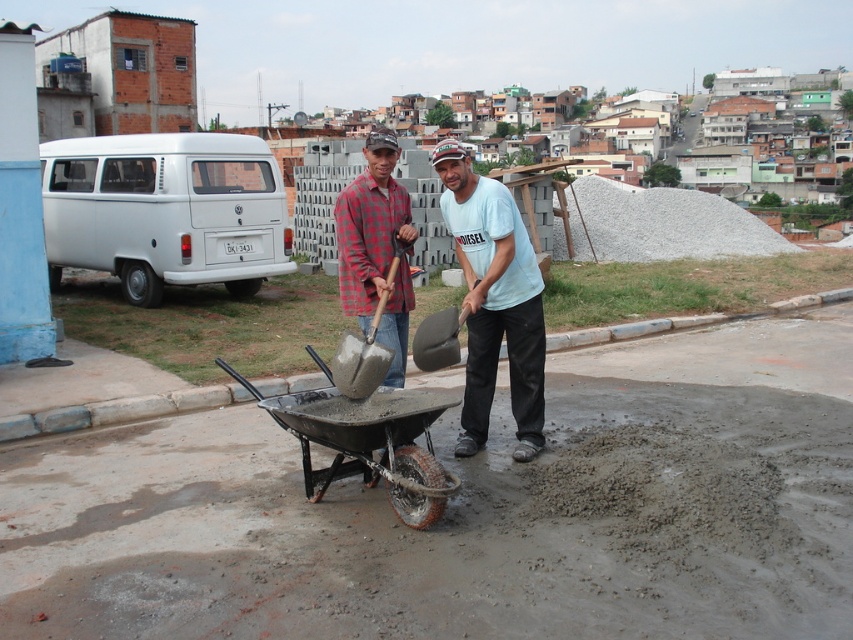
Who is higher up, metallic gray wheelbarrow at center or matte gray shovel at center?

matte gray shovel at center

Is metallic gray wheelbarrow at center wider than matte gray shovel at center?

Yes.

Between point (283, 428) and point (364, 397), which one is positioned in front?

Point (364, 397) is more forward.

This screenshot has width=853, height=640. Find the location of `metallic gray wheelbarrow at center`. metallic gray wheelbarrow at center is located at coordinates (368, 442).

Is matte concrete shovel at center positioned before matte gray shovel at center?

No, it is not.

Locate an element on the screen. This screenshot has width=853, height=640. matte concrete shovel at center is located at coordinates point(494,301).

Identify the location of matte concrete shovel at center. (494, 301).

Who is positioned more to the left, matte concrete shovel at center or metallic gray wheelbarrow at center?

metallic gray wheelbarrow at center

Is matte concrete shovel at center positioned in front of metallic gray wheelbarrow at center?

No, matte concrete shovel at center is further to the viewer.

The width and height of the screenshot is (853, 640). Find the location of `matte concrete shovel at center`. matte concrete shovel at center is located at coordinates (494, 301).

You are a GUI agent. You are given a task and a screenshot of the screen. Output one action in this format:
    pyautogui.click(x=<x>, y=<y>)
    Task: Click on the matte concrete shovel at center
    
    Given the screenshot: What is the action you would take?
    pos(494,301)